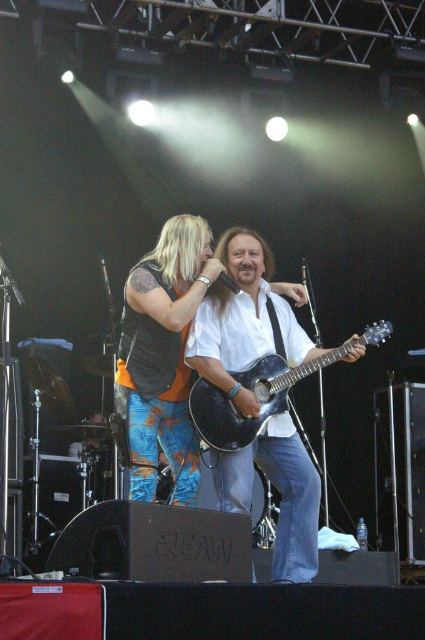
You are a stagehand who needs to quickly move the matte black acoustic guitar at center closer to the orange printed pants at center during the performance. How much distance in centimeters do you need to cover to place the guitar right next to the pants?

The distance between the orange printed pants at center and the matte black acoustic guitar at center is 54.71 centimeters. To place the guitar right next to the pants, you would need to move it approximately 54.71 centimeters closer.

You are standing at the camera position and want to throw a water balloon to hit the point at coordinates point [235,321]. What is the approximate distance you need to throw the water balloon to reach that point?

The distance of point [235,321] from camera is 7.36 meters, so you need to throw the water balloon approximately 7.36 meters to reach that point.